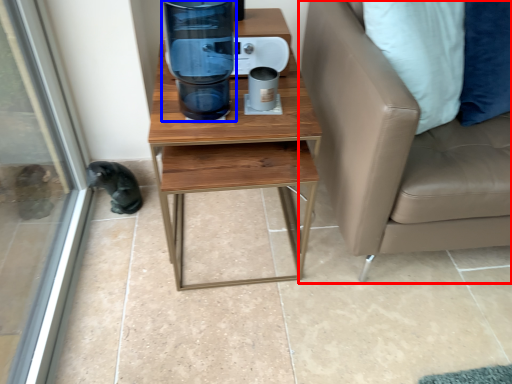
Question: Among these objects, which one is farthest to the camera, studio couch (highlighted by a red box) or water cooler (highlighted by a blue box)?

Choices:
 (A) studio couch
 (B) water cooler

Answer: (B)